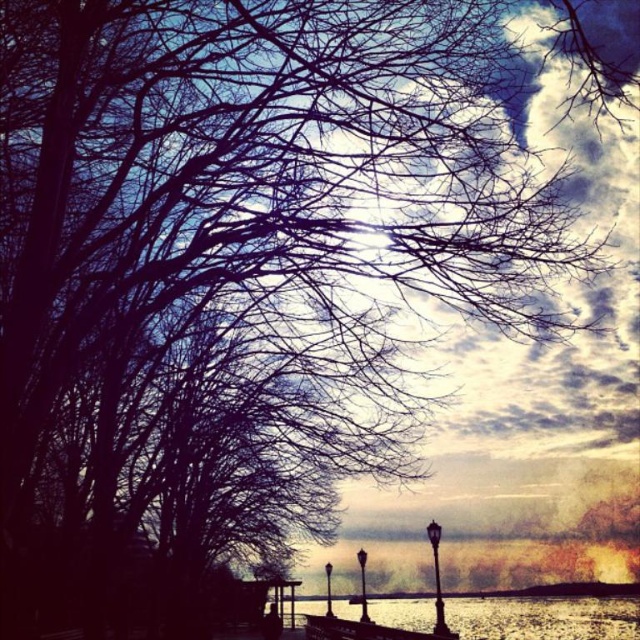
Question: Which point is closer to the camera?

Choices:
 (A) wooden dock at lower center
 (B) reflective silver water at lower center

Answer: (A)

Question: Can you confirm if reflective silver water at lower center is thinner than wooden dock at lower center?

Choices:
 (A) yes
 (B) no

Answer: (B)

Question: Which point appears closest to the camera in this image?

Choices:
 (A) (362, 636)
 (B) (499, 620)

Answer: (B)

Question: Does reflective silver water at lower center have a smaller size compared to wooden dock at lower center?

Choices:
 (A) yes
 (B) no

Answer: (B)

Question: Can you confirm if reflective silver water at lower center is positioned to the right of wooden dock at lower center?

Choices:
 (A) yes
 (B) no

Answer: (A)

Question: Which point is farther to the camera?

Choices:
 (A) (369, 636)
 (B) (524, 605)

Answer: (A)